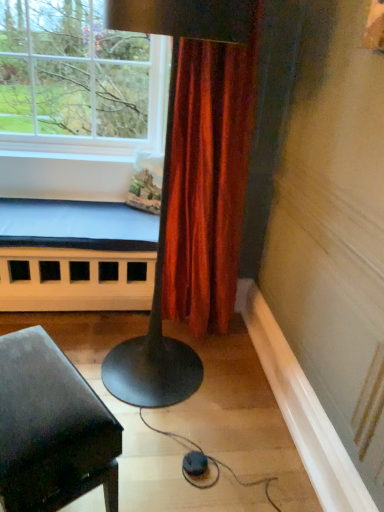
Question: Is clear glass window at upper left not close to white painted wood bed frame at lower left?

Choices:
 (A) no
 (B) yes

Answer: (A)

Question: Does clear glass window at upper left appear on the right side of white painted wood bed frame at lower left?

Choices:
 (A) yes
 (B) no

Answer: (A)

Question: Would you say white painted wood bed frame at lower left is part of clear glass window at upper left's contents?

Choices:
 (A) yes
 (B) no

Answer: (B)

Question: From a real-world perspective, is clear glass window at upper left beneath white painted wood bed frame at lower left?

Choices:
 (A) yes
 (B) no

Answer: (B)

Question: From the image's perspective, is clear glass window at upper left on top of white painted wood bed frame at lower left?

Choices:
 (A) yes
 (B) no

Answer: (A)

Question: Is clear glass window at upper left further to camera compared to white painted wood bed frame at lower left?

Choices:
 (A) yes
 (B) no

Answer: (B)

Question: From the image's perspective, is white painted wood bed frame at lower left below matte black piano at lower left?

Choices:
 (A) yes
 (B) no

Answer: (B)

Question: Is white painted wood bed frame at lower left not inside matte black piano at lower left?

Choices:
 (A) no
 (B) yes

Answer: (B)

Question: From the image's perspective, does white painted wood bed frame at lower left appear higher than matte black piano at lower left?

Choices:
 (A) no
 (B) yes

Answer: (B)

Question: From a real-world perspective, is white painted wood bed frame at lower left located higher than matte black piano at lower left?

Choices:
 (A) yes
 (B) no

Answer: (A)

Question: Is white painted wood bed frame at lower left smaller than matte black piano at lower left?

Choices:
 (A) yes
 (B) no

Answer: (B)

Question: Is white painted wood bed frame at lower left to the right of matte black piano at lower left from the viewer's perspective?

Choices:
 (A) yes
 (B) no

Answer: (B)

Question: Considering the relative positions of matte black piano at lower left and white painted wood bed frame at lower left in the image provided, is matte black piano at lower left to the right of white painted wood bed frame at lower left from the viewer's perspective?

Choices:
 (A) yes
 (B) no

Answer: (A)